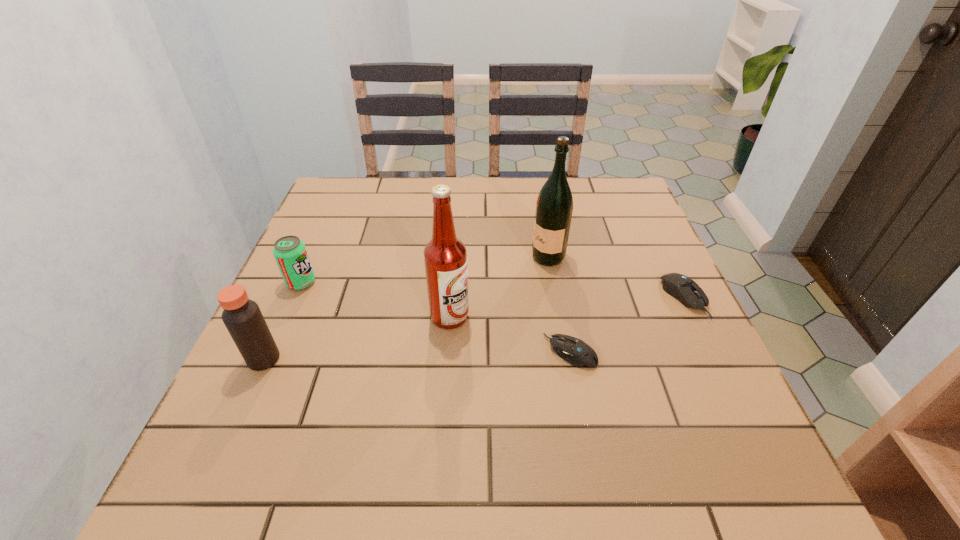
Find the location of a particular element. free space located on the front-facing side of the third shortest object is located at coordinates (468, 282).

Identify the location of free space located on the back of the third tallest object. (312, 252).

Identify the location of free space located on the label side of the fourth object from right to left. [x=579, y=316].

Find the location of a particular element. blank space located 0.160m on the front-facing side of the liquor is located at coordinates (468, 257).

Locate an element on the screen. vacant point located 0.400m on the front-facing side of the liquor is located at coordinates (373, 257).

This screenshot has width=960, height=540. I want to click on free space located 0.170m on the front-facing side of the liquor, so click(465, 257).

Locate an element on the screen. This screenshot has width=960, height=540. pop soda positioned at the left edge is located at coordinates (290, 253).

Locate an element on the screen. vinegar present at the left edge is located at coordinates (242, 317).

Where is `object positioned at the right edge`? object positioned at the right edge is located at coordinates (684, 289).

Find the location of a particular element. vacant space at the far edge of the desktop is located at coordinates (415, 180).